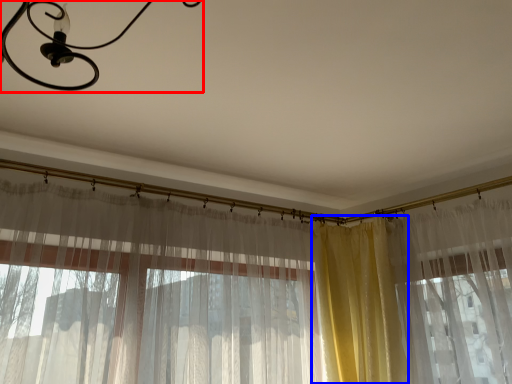
Question: Which point is further to the camera, light fixture (highlighted by a red box) or curtain (highlighted by a blue box)?

Choices:
 (A) light fixture
 (B) curtain

Answer: (B)